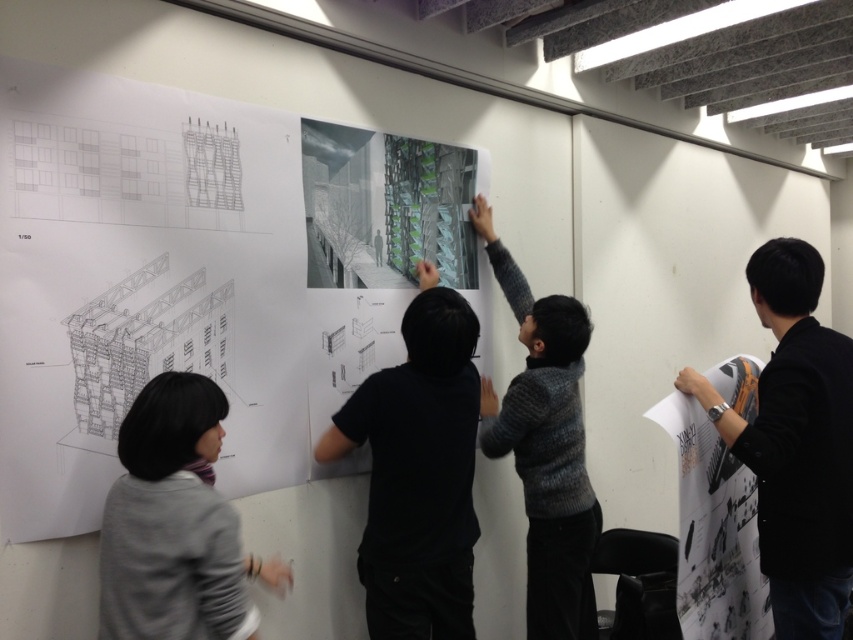
Question: Can you confirm if white paper architectural drawing at upper center is thinner than gray sweater at lower left?

Choices:
 (A) no
 (B) yes

Answer: (A)

Question: Estimate the real-world distances between objects in this image. Which object is closer to the black matte shirt at center?

Choices:
 (A) gray sweater at lower left
 (B) black fabric at right
 (C) white paper architectural drawing at upper center
 (D) gray knitted sweater at upper center

Answer: (D)

Question: Which point is farther from the camera taking this photo?

Choices:
 (A) (114, 636)
 (B) (38, 461)
 (C) (563, 625)

Answer: (C)

Question: Is white paper architectural drawing at upper center further to camera compared to black fabric at right?

Choices:
 (A) yes
 (B) no

Answer: (B)

Question: Is white paper architectural drawing at upper center above black matte shirt at center?

Choices:
 (A) yes
 (B) no

Answer: (A)

Question: Which object appears farthest from the camera in this image?

Choices:
 (A) white paper architectural drawing at upper center
 (B) black matte shirt at center
 (C) gray sweater at lower left

Answer: (B)